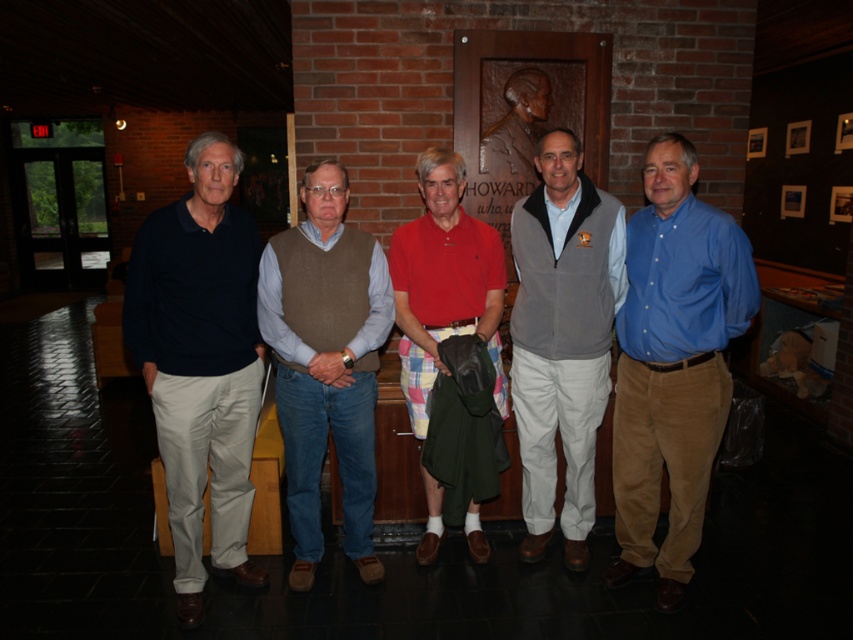
The width and height of the screenshot is (853, 640). Describe the element at coordinates (672, 364) in the screenshot. I see `blue corduroy pants at right` at that location.

Which is more to the left, blue corduroy pants at right or matte bronze bust at center?

matte bronze bust at center

Image resolution: width=853 pixels, height=640 pixels. In order to click on blue corduroy pants at right in this screenshot , I will do `click(672, 364)`.

Where is `blue corduroy pants at right`? The height and width of the screenshot is (640, 853). blue corduroy pants at right is located at coordinates (672, 364).

Measure the distance from dark blue cotton polo shirt at left to brown wool vest at center.

dark blue cotton polo shirt at left and brown wool vest at center are 10.80 inches apart from each other.

Is point (173, 307) less distant than point (300, 369)?

Yes.

Does point (158, 384) lie in front of point (292, 456)?

Yes, point (158, 384) is closer to viewer.

Where is `dark blue cotton polo shirt at left`? This screenshot has height=640, width=853. dark blue cotton polo shirt at left is located at coordinates (201, 362).

Is dark blue cotton polo shirt at left behind matte bronze bust at center?

No, dark blue cotton polo shirt at left is closer to the viewer.

Between dark blue cotton polo shirt at left and matte bronze bust at center, which one is positioned higher?

matte bronze bust at center is above.

Between point (136, 346) and point (480, 164), which one is positioned behind?

The point (480, 164) is behind.

Where is `dark blue cotton polo shirt at left`? dark blue cotton polo shirt at left is located at coordinates (201, 362).